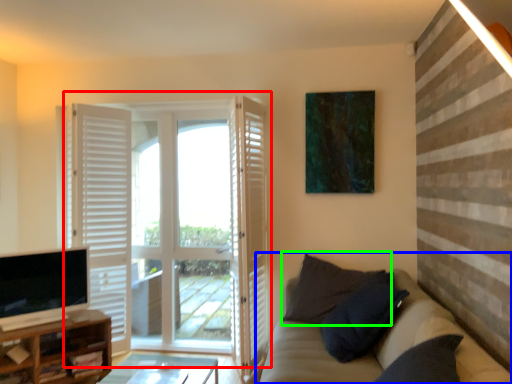
Question: Considering the real-world distances, which object is farthest from door (highlighted by a red box)? studio couch (highlighted by a blue box) or pillow (highlighted by a green box)?

Choices:
 (A) studio couch
 (B) pillow

Answer: (A)